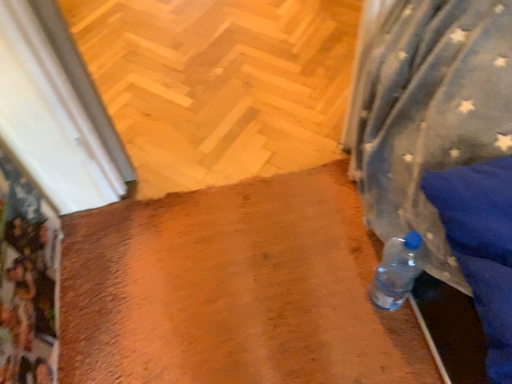
Question: Can you confirm if wooden floor at center is positioned to the right of clear plastic bottle at lower right?

Choices:
 (A) yes
 (B) no

Answer: (B)

Question: From the image's perspective, is wooden floor at center below clear plastic bottle at lower right?

Choices:
 (A) no
 (B) yes

Answer: (A)

Question: Does wooden floor at center have a greater width compared to clear plastic bottle at lower right?

Choices:
 (A) no
 (B) yes

Answer: (B)

Question: Is wooden floor at center facing away from clear plastic bottle at lower right?

Choices:
 (A) no
 (B) yes

Answer: (A)

Question: Is wooden floor at center not near clear plastic bottle at lower right?

Choices:
 (A) yes
 (B) no

Answer: (B)

Question: Considering the relative sizes of wooden floor at center and clear plastic bottle at lower right in the image provided, is wooden floor at center taller than clear plastic bottle at lower right?

Choices:
 (A) no
 (B) yes

Answer: (B)

Question: Is clear plastic bottle at lower right positioned in front of wooden floor at center?

Choices:
 (A) no
 (B) yes

Answer: (B)

Question: Does clear plastic bottle at lower right have a lesser height compared to wooden floor at center?

Choices:
 (A) no
 (B) yes

Answer: (B)

Question: Is clear plastic bottle at lower right next to wooden floor at center?

Choices:
 (A) yes
 (B) no

Answer: (B)

Question: Does clear plastic bottle at lower right have a greater width compared to wooden floor at center?

Choices:
 (A) no
 (B) yes

Answer: (A)

Question: Does clear plastic bottle at lower right lie behind wooden floor at center?

Choices:
 (A) yes
 (B) no

Answer: (B)

Question: Considering the relative sizes of clear plastic bottle at lower right and wooden floor at center in the image provided, is clear plastic bottle at lower right smaller than wooden floor at center?

Choices:
 (A) no
 (B) yes

Answer: (B)

Question: Looking at the image, does clear plastic bottle at lower right seem bigger or smaller compared to wooden floor at center?

Choices:
 (A) big
 (B) small

Answer: (B)